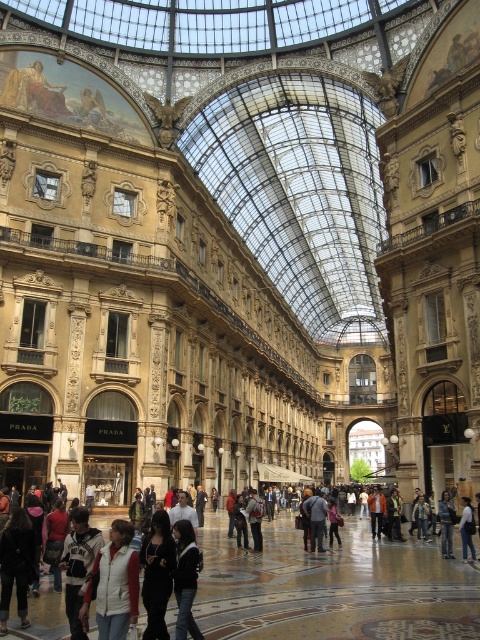
You are a fashion designer visiting the Galleria Vittorio Emanuele II in Milan. You see a black fabric jacket at center and a dark gray sweater at center. How far apart are these two items in meters?

The black fabric jacket at center and dark gray sweater at center are 2.20 meters apart.

Looking at this image, you are a customer in the shopping arcade and see both the white cotton hoodie at center and the white cotton shirt at center. Which clothing item is positioned higher in the image?

The white cotton hoodie at center is positioned higher than the white cotton shirt at center.

You are standing in the grand shopping arcade and want to take a photo of both the point at coordinates point [191,600] and point [444,500]. Which point should you focus on first to ensure both are in focus?

You should focus on point [191,600] first because it is closer to you than point [444,500]. This ensures the depth of field captures both points in focus.